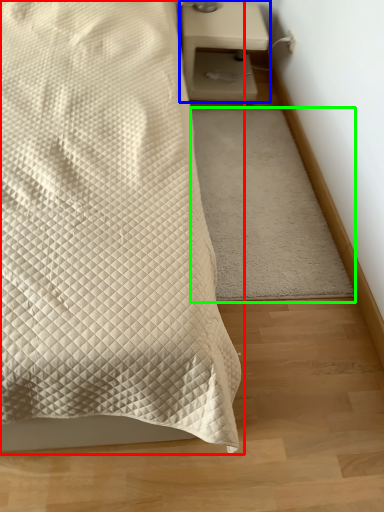
Question: Which object is the closest to the bed (highlighted by a red box)? Choose among these: nightstand (highlighted by a blue box) or mat (highlighted by a green box).

Choices:
 (A) nightstand
 (B) mat

Answer: (B)